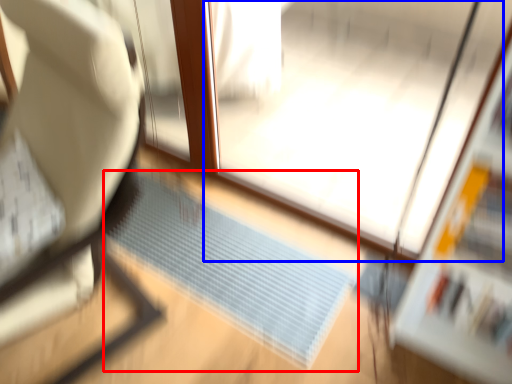
Question: Which object appears farthest to the camera in this image, doormat (highlighted by a red box) or screen door (highlighted by a blue box)?

Choices:
 (A) doormat
 (B) screen door

Answer: (A)